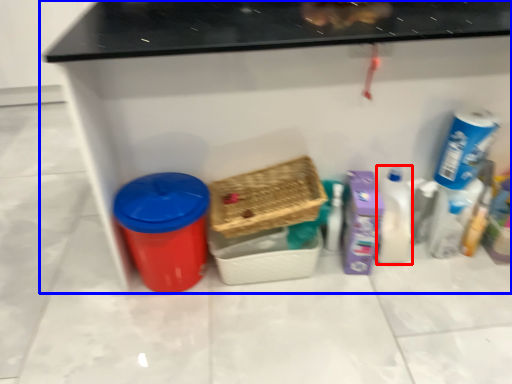
Question: Which object is further to the camera taking this photo, cleaning product (highlighted by a red box) or furniture (highlighted by a blue box)?

Choices:
 (A) cleaning product
 (B) furniture

Answer: (A)